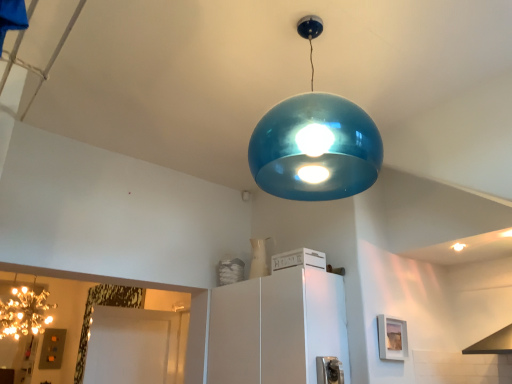
What do you see at coordinates (298, 259) in the screenshot?
I see `white matte crate at center, arranged as the 1th appliance when viewed from the back` at bounding box center [298, 259].

The image size is (512, 384). What do you see at coordinates (329, 370) in the screenshot?
I see `metallic silver outlet at lower center, which is counted as the first appliance, starting from the front` at bounding box center [329, 370].

In order to click on glossy metallic light bulb at upper center in this screenshot , I will do `click(458, 246)`.

I want to click on white matte cabinet at center, so click(x=277, y=328).

Relative to metallic silver outlet at lower center, which is the 1th appliance in bottom-to-top order, is sparkling gold chandelier at left in front or behind?

sparkling gold chandelier at left is positioned farther from the viewer than metallic silver outlet at lower center, which is the 1th appliance in bottom-to-top order.

Based on the photo, is sparkling gold chandelier at left at the left side of metallic silver outlet at lower center, which ranks as the 2th appliance in back-to-front order?

Yes, sparkling gold chandelier at left is to the left of metallic silver outlet at lower center, which ranks as the 2th appliance in back-to-front order.

Is sparkling gold chandelier at left positioned with its back to metallic silver outlet at lower center, which is the 1th appliance in bottom-to-top order?

sparkling gold chandelier at left does not have its back to metallic silver outlet at lower center, which is the 1th appliance in bottom-to-top order.

Is sparkling gold chandelier at left turned away from white matte crate at center, acting as the 2th appliance starting from the front?

No, sparkling gold chandelier at left is not facing the opposite direction of white matte crate at center, acting as the 2th appliance starting from the front.

Considering the relative sizes of sparkling gold chandelier at left and white matte crate at center, positioned as the 2th appliance in bottom-to-top order, in the image provided, is sparkling gold chandelier at left shorter than white matte crate at center, positioned as the 2th appliance in bottom-to-top order,?

No, sparkling gold chandelier at left is not shorter than white matte crate at center, positioned as the 2th appliance in bottom-to-top order.

Is sparkling gold chandelier at left touching white matte crate at center, acting as the 2th appliance starting from the front?

There is a gap between sparkling gold chandelier at left and white matte crate at center, acting as the 2th appliance starting from the front.

From a real-world perspective, is sparkling gold chandelier at left on white matte crate at center, arranged as the 1th appliance when viewed from the back?

Incorrect, from a real-world perspective, sparkling gold chandelier at left is lower than white matte crate at center, arranged as the 1th appliance when viewed from the back.

Considering the sizes of objects white matte crate at center, arranged as the 1th appliance when viewed from the back, and sparkling gold chandelier at left in the image provided, who is bigger, white matte crate at center, arranged as the 1th appliance when viewed from the back, or sparkling gold chandelier at left?

Bigger between the two is sparkling gold chandelier at left.

Based on the photo, from the image's perspective, would you say white matte crate at center, acting as the 2th appliance starting from the front, is positioned over sparkling gold chandelier at left?

Yes, from the image's perspective, white matte crate at center, acting as the 2th appliance starting from the front, is over sparkling gold chandelier at left.

From a real-world perspective, is white matte crate at center, arranged as the 1th appliance when viewed from the back, positioned above or below sparkling gold chandelier at left?

white matte crate at center, arranged as the 1th appliance when viewed from the back, is situated higher than sparkling gold chandelier at left in the real world.

The width and height of the screenshot is (512, 384). Find the location of `lamp behind the white matte crate at center, acting as the 2th appliance starting from the front`. lamp behind the white matte crate at center, acting as the 2th appliance starting from the front is located at coordinates click(x=25, y=313).

Consider the image. Can you tell me how much metallic silver outlet at lower center, which ranks as the 2th appliance in back-to-front order, and glossy metallic light bulb at upper center differ in facing direction?

91.1 degrees separate the facing orientations of metallic silver outlet at lower center, which ranks as the 2th appliance in back-to-front order, and glossy metallic light bulb at upper center.

Consider the image. Does metallic silver outlet at lower center, the 2th appliance in the top-to-bottom sequence, have a greater width compared to glossy metallic light bulb at upper center?

Correct, the width of metallic silver outlet at lower center, the 2th appliance in the top-to-bottom sequence, exceeds that of glossy metallic light bulb at upper center.

Is metallic silver outlet at lower center, the 2th appliance in the top-to-bottom sequence, positioned with its back to glossy metallic light bulb at upper center?

metallic silver outlet at lower center, the 2th appliance in the top-to-bottom sequence, does not have its back to glossy metallic light bulb at upper center.

From a real-world perspective, is metallic silver outlet at lower center, which is counted as the first appliance, starting from the front, positioned over glossy metallic light bulb at upper center based on gravity?

No, from a real-world perspective, metallic silver outlet at lower center, which is counted as the first appliance, starting from the front, is not over glossy metallic light bulb at upper center

Between white matte crate at center, arranged as the 1th appliance when viewed from the back, and white matte cabinet at center, which one has more height?

white matte cabinet at center.

Considering their positions, is white matte crate at center, arranged as the 1th appliance when viewed from the back, located in front of or behind white matte cabinet at center?

Clearly, white matte crate at center, arranged as the 1th appliance when viewed from the back, is behind white matte cabinet at center.

Is white matte cabinet at center completely or partially inside sparkling gold chandelier at left?

That's incorrect, white matte cabinet at center is not inside sparkling gold chandelier at left.

Looking at this image, which point is more distant from viewer, (26, 290) or (265, 314)?

The point (26, 290) is behind.

From their relative heights in the image, would you say sparkling gold chandelier at left is taller or shorter than white matte cabinet at center?

Clearly, sparkling gold chandelier at left is shorter compared to white matte cabinet at center.

This screenshot has height=384, width=512. I want to click on lamp located below the white matte cabinet at center (from the image's perspective), so click(25, 313).

Between white matte cabinet at center and metallic silver outlet at lower center, which is counted as the first appliance, starting from the front, which one has more height?

Standing taller between the two is white matte cabinet at center.

Identify the location of appliance that appears below the white matte cabinet at center (from a real-world perspective). The height and width of the screenshot is (384, 512). (329, 370).

Is white matte cabinet at center at the right side of metallic silver outlet at lower center, the 2th appliance in the top-to-bottom sequence?

In fact, white matte cabinet at center is to the left of metallic silver outlet at lower center, the 2th appliance in the top-to-bottom sequence.

Is white matte cabinet at center bigger than metallic silver outlet at lower center, the 2th appliance in the top-to-bottom sequence?

Correct, white matte cabinet at center is larger in size than metallic silver outlet at lower center, the 2th appliance in the top-to-bottom sequence.

At what (x,y) coordinates should I click in order to perform the action: click on appliance that is the 2nd one when counting rightward from the sparkling gold chandelier at left. Please return your answer as a coordinate pair (x, y). Looking at the image, I should click on (329, 370).

In the image, there is a white matte crate at center, arranged as the 1th appliance when viewed from the back. Where is `lamp below it (from the image's perspective)`? This screenshot has width=512, height=384. lamp below it (from the image's perspective) is located at coordinates (25, 313).

When comparing their distances from sparkling gold chandelier at left, does white matte cabinet at center or glossy metallic light bulb at upper center seem further?

glossy metallic light bulb at upper center is further to sparkling gold chandelier at left.

Considering their positions, is metallic silver outlet at lower center, the 2th appliance in the top-to-bottom sequence, positioned closer to glossy metallic light bulb at upper center than sparkling gold chandelier at left?

metallic silver outlet at lower center, the 2th appliance in the top-to-bottom sequence, lies closer to glossy metallic light bulb at upper center than the other object.

Which object lies further to the anchor point white matte crate at center, marked as the 1th appliance in a top-to-bottom arrangement, metallic silver outlet at lower center, which is counted as the first appliance, starting from the front, or white matte cabinet at center?

The object further to white matte crate at center, marked as the 1th appliance in a top-to-bottom arrangement, is metallic silver outlet at lower center, which is counted as the first appliance, starting from the front.

Which object lies nearer to the anchor point white matte cabinet at center, white matte crate at center, positioned as the 2th appliance in bottom-to-top order, or metallic silver outlet at lower center, which is the 1th appliance in bottom-to-top order?

white matte crate at center, positioned as the 2th appliance in bottom-to-top order, is closer to white matte cabinet at center.

Looking at the image, which one is located closer to white matte cabinet at center, glossy metallic light bulb at upper center or white matte crate at center, positioned as the 2th appliance in bottom-to-top order?

white matte crate at center, positioned as the 2th appliance in bottom-to-top order.

Looking at the image, which one is located closer to metallic silver outlet at lower center, which is the 1th appliance in bottom-to-top order, white matte cabinet at center or glossy metallic light bulb at upper center?

white matte cabinet at center lies closer to metallic silver outlet at lower center, which is the 1th appliance in bottom-to-top order, than the other object.

From the image, which object appears to be farther from metallic silver outlet at lower center, which ranks as the 2th appliance in back-to-front order, sparkling gold chandelier at left or white matte crate at center, acting as the 2th appliance starting from the front?

sparkling gold chandelier at left.

From the image, which object appears to be farther from sparkling gold chandelier at left, metallic silver outlet at lower center, which is counted as the first appliance, starting from the front, or glossy metallic light bulb at upper center?

Among the two, glossy metallic light bulb at upper center is located further to sparkling gold chandelier at left.

You are a GUI agent. You are given a task and a screenshot of the screen. Output one action in this format:
    pyautogui.click(x=<x>, y=<y>)
    Task: Click on the appliance between sparkling gold chandelier at left and metallic silver outlet at lower center, which is the 1th appliance in bottom-to-top order, from left to right
    
    Given the screenshot: What is the action you would take?
    pyautogui.click(x=298, y=259)

Where is `appliance located between white matte crate at center, acting as the 2th appliance starting from the front, and glossy metallic light bulb at upper center in the left-right direction`? The width and height of the screenshot is (512, 384). appliance located between white matte crate at center, acting as the 2th appliance starting from the front, and glossy metallic light bulb at upper center in the left-right direction is located at coordinates (329, 370).

Where is `cabinetry between white matte crate at center, marked as the 1th appliance in a top-to-bottom arrangement, and metallic silver outlet at lower center, which is the 1th appliance in bottom-to-top order, vertically`? The image size is (512, 384). cabinetry between white matte crate at center, marked as the 1th appliance in a top-to-bottom arrangement, and metallic silver outlet at lower center, which is the 1th appliance in bottom-to-top order, vertically is located at coordinates (x=277, y=328).

Locate an element on the screen. cabinetry situated between sparkling gold chandelier at left and metallic silver outlet at lower center, which is the 1th appliance in bottom-to-top order, from left to right is located at coordinates (277, 328).